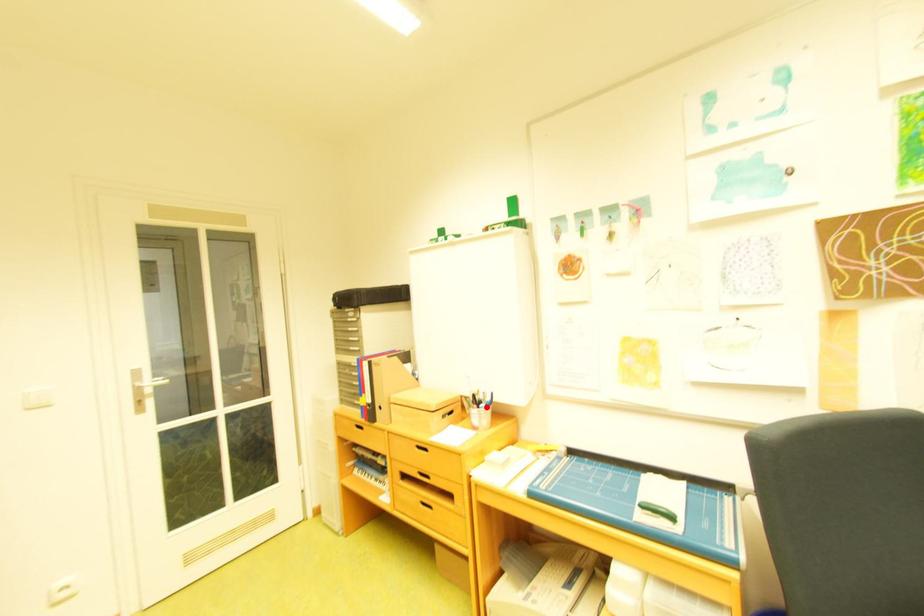
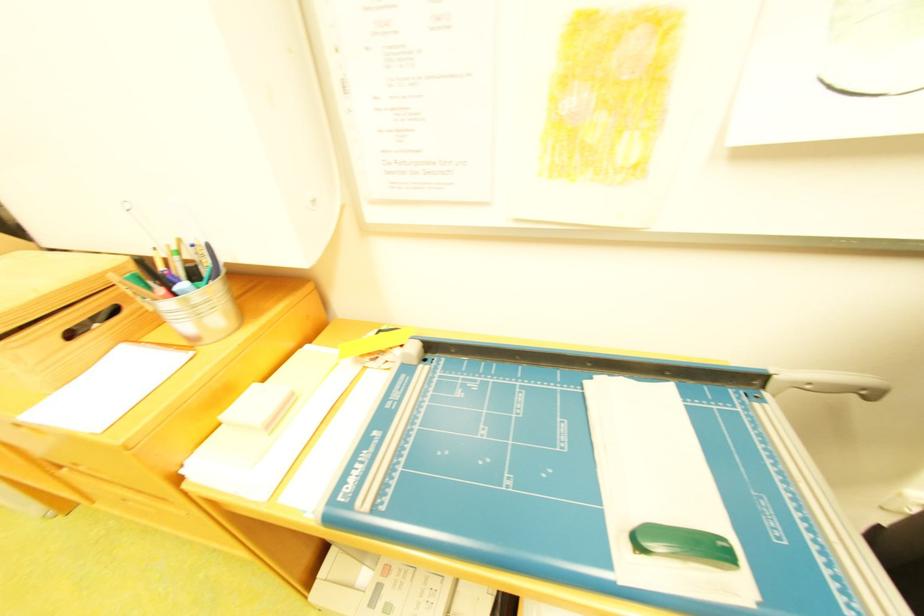
Locate, in the second image, the point that corresponds to the highlighted location in the first image.

(173, 292)